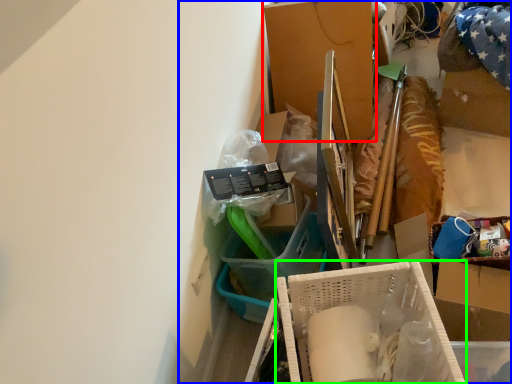
Question: Which object is positioned closest to box (highlighted by a red box)? Select from collection (highlighted by a blue box) and box (highlighted by a green box).

Choices:
 (A) collection
 (B) box

Answer: (A)